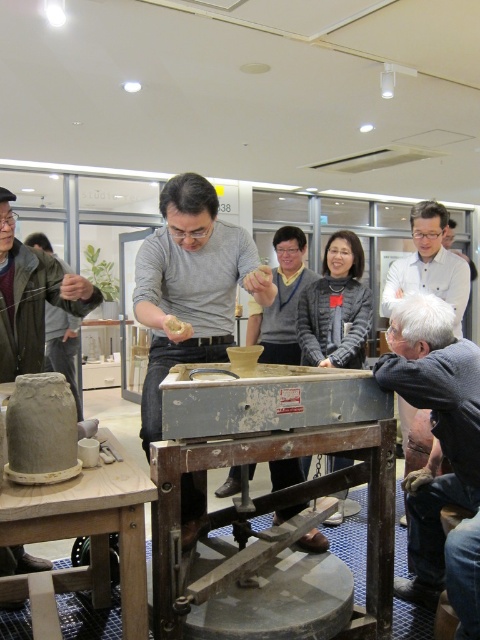
Based on the photo, is gray wool sweater at lower right shorter than gray wool sweater at center?

In fact, gray wool sweater at lower right may be taller than gray wool sweater at center.

Find the location of `gray wool sweater at lower right`. gray wool sweater at lower right is located at coordinates (441, 451).

Which is more to the right, matte gray clay pot at left or gray wool sweater at center?

gray wool sweater at center

Is point (27, 336) less distant than point (400, 282)?

Yes, point (27, 336) is in front of point (400, 282).

Describe the element at coordinates (31, 296) in the screenshot. The height and width of the screenshot is (640, 480). I see `matte gray clay pot at left` at that location.

Where is `matte gray clay pot at left`? Image resolution: width=480 pixels, height=640 pixels. matte gray clay pot at left is located at coordinates (31, 296).

Between gray wool sweater at lower right and wooden table at lower left, which one is positioned higher?

gray wool sweater at lower right

Can you confirm if gray wool sweater at lower right is bigger than wooden table at lower left?

Yes, gray wool sweater at lower right is bigger than wooden table at lower left.

Does point (472, 406) come behind point (109, 497)?

Yes, point (472, 406) is behind point (109, 497).

Where is `gray wool sweater at lower right`? The width and height of the screenshot is (480, 640). gray wool sweater at lower right is located at coordinates (441, 451).